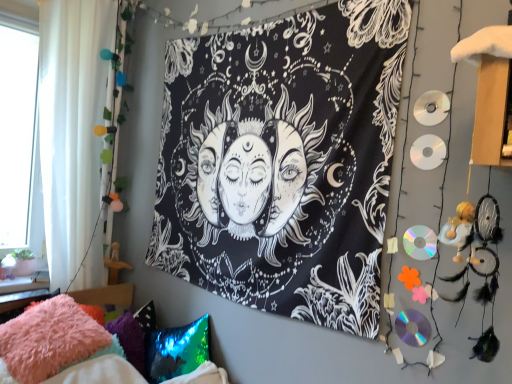
Question: Is holographic sequin pillow at lower left, marked as the 2th pillow in a left-to-right arrangement, spatially inside black fabric tapestry at center, or outside of it?

Choices:
 (A) outside
 (B) inside

Answer: (A)

Question: Considering the positions of point (167, 332) and point (249, 167), is point (167, 332) closer or farther from the camera than point (249, 167)?

Choices:
 (A) closer
 (B) farther

Answer: (B)

Question: Considering the real-world distances, which object is closest to the fuzzy pink pillow at lower left?

Choices:
 (A) holographic sequin pillow at lower left, the 1th pillow when ordered from right to left
 (B) white sheer curtain at left
 (C) fluffy pink pillow at lower left, which ranks as the 2th pillow in right-to-left order
 (D) black fabric tapestry at center

Answer: (C)

Question: Which object is positioned closest to the black fabric tapestry at center?

Choices:
 (A) white sheer curtain at left
 (B) holographic sequin pillow at lower left, marked as the 2th pillow in a left-to-right arrangement
 (C) fuzzy pink pillow at lower left
 (D) fluffy pink pillow at lower left, which ranks as the 2th pillow in right-to-left order

Answer: (B)